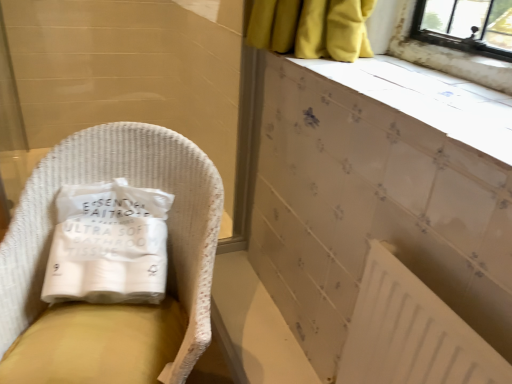
Question: Is white matte radiator at lower right a part of white wicker chair at left?

Choices:
 (A) no
 (B) yes

Answer: (A)

Question: Is white wicker chair at left positioned with its back to white matte radiator at lower right?

Choices:
 (A) no
 (B) yes

Answer: (A)

Question: From a real-world perspective, is white wicker chair at left on white matte radiator at lower right?

Choices:
 (A) yes
 (B) no

Answer: (B)

Question: Is white wicker chair at left positioned far away from white matte radiator at lower right?

Choices:
 (A) no
 (B) yes

Answer: (A)

Question: Considering the relative sizes of white wicker chair at left and white matte radiator at lower right in the image provided, is white wicker chair at left smaller than white matte radiator at lower right?

Choices:
 (A) yes
 (B) no

Answer: (B)

Question: Does white wicker chair at left have a greater height compared to white matte radiator at lower right?

Choices:
 (A) no
 (B) yes

Answer: (B)

Question: Can you confirm if white matte radiator at lower right is shorter than white paper towel at left?

Choices:
 (A) no
 (B) yes

Answer: (A)

Question: From a real-world perspective, is white matte radiator at lower right on white paper towel at left?

Choices:
 (A) no
 (B) yes

Answer: (A)

Question: Is white paper towel at left inside white matte radiator at lower right?

Choices:
 (A) yes
 (B) no

Answer: (B)

Question: Does white matte radiator at lower right have a smaller size compared to white paper towel at left?

Choices:
 (A) no
 (B) yes

Answer: (B)

Question: Can you confirm if white matte radiator at lower right is taller than white paper towel at left?

Choices:
 (A) no
 (B) yes

Answer: (B)

Question: Is white matte radiator at lower right to the right of white paper towel at left from the viewer's perspective?

Choices:
 (A) no
 (B) yes

Answer: (B)

Question: From the image's perspective, does white textured ledge at upper right appear lower than white paper towel at left?

Choices:
 (A) no
 (B) yes

Answer: (A)